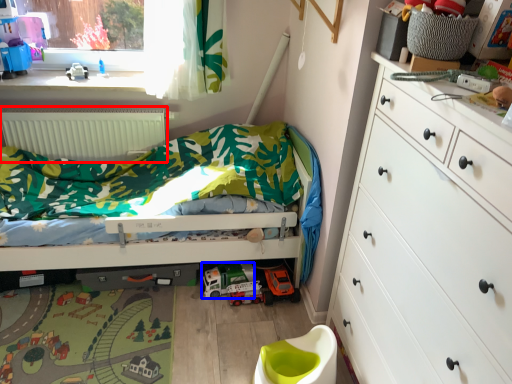
Question: Which object is further to the camera taking this photo, radiator (highlighted by a red box) or toy car (highlighted by a blue box)?

Choices:
 (A) radiator
 (B) toy car

Answer: (A)